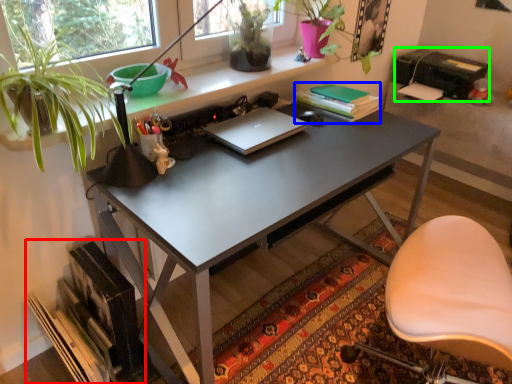
Question: Which object is the farthest from book (highlighted by a red box)? Choose among these: book (highlighted by a blue box) or printer (highlighted by a green box).

Choices:
 (A) book
 (B) printer

Answer: (B)